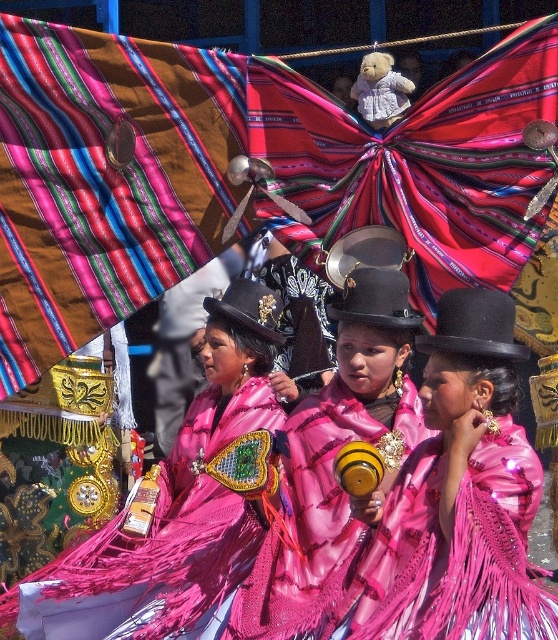
You are standing in the crowd watching the parade and want to take a photo of both the point at coordinates point (109,605) and point (310,436). Which point should you focus on first to ensure both are in focus?

You should focus on point (109,605) first because it is closer to the camera than point (310,436). This ensures the closer point is in focus, and the farther point will also be within the depth of field.

You are a photographer at the event and want to capture the shiny pink dress at center and the shiny pink fabric at center in a single shot. Which object should you focus on first if you want to ensure both are in focus?

The shiny pink fabric at center is located below the shiny pink dress at center. To ensure both are in focus, you should focus on the shiny pink dress at center first since it is closer to the camera.